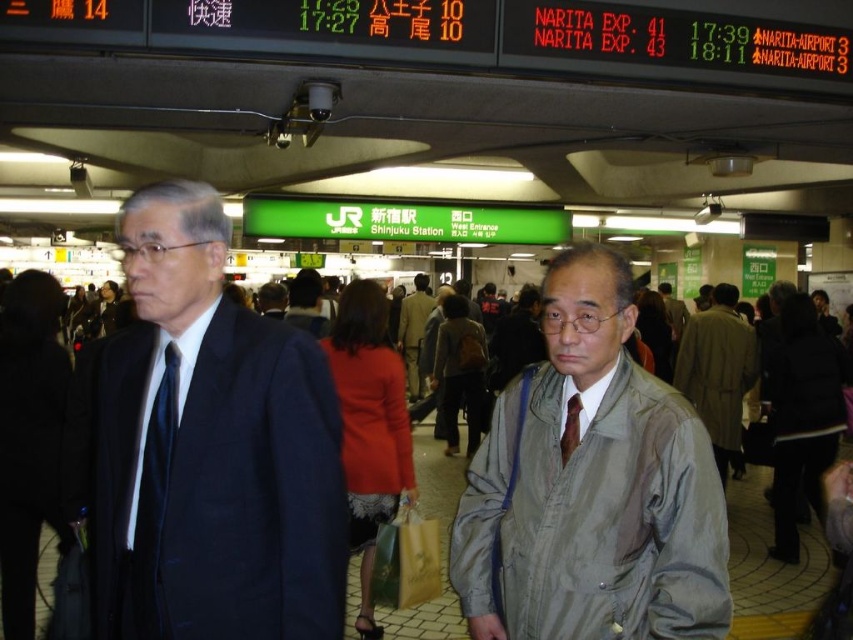
Looking at this image, you are standing at the entrance of Shinjuku Station and see two points marked in the scene. The first point is at coordinate point (254, 621) and the second point is at coordinate point (734, 358). Which point is closer to you?

Point (254, 621) is in front of point (734, 358), so it is closer to you.

You are a photographer trying to capture a candid shot of both the gray fabric jacket at center and the brown silk tie at center in the crowded Shinjuku Station. Given that your camera has a maximum focus range of 10 inches, will you be able to capture both subjects in sharp focus at the same time?

The gray fabric jacket at center and brown silk tie at center are 9.78 inches apart from each other, which is within the camera focus range of 10 inches. Therefore, both subjects can be captured in sharp focus simultaneously.